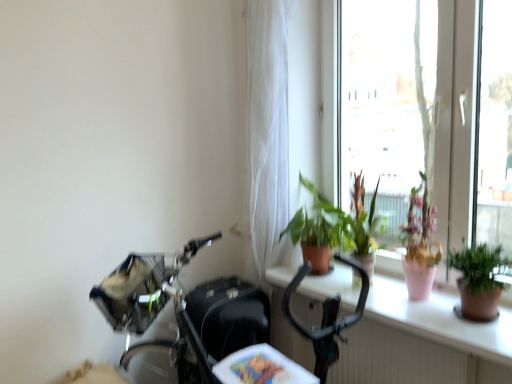
What is the approximate width of white sheer curtain at upper center?

9.20 inches.

What is the approximate width of green matte plant at upper right, the second houseplant in the back-to-front sequence?

9.58 inches.

Locate an element on the screen. This screenshot has width=512, height=384. white sheer curtain at upper center is located at coordinates (267, 132).

From a real-world perspective, between green matte plant at upper right, the 2th houseplant when ordered from left to right, and terracotta pot at center, who is vertically lower?

terracotta pot at center, from a real-world perspective.

Considering the sizes of objects green matte plant at upper right, placed as the first houseplant when sorted from right to left, and terracotta pot at center in the image provided, who is wider, green matte plant at upper right, placed as the first houseplant when sorted from right to left, or terracotta pot at center?

terracotta pot at center is wider.

Is green matte plant at upper right, placed as the first houseplant when sorted from right to left, aimed at terracotta pot at center?

No, green matte plant at upper right, placed as the first houseplant when sorted from right to left, is not turned towards terracotta pot at center.

How much distance is there between green matte plant at upper right, which appears as the 1th houseplant when viewed from the front, and terracotta pot at center?

green matte plant at upper right, which appears as the 1th houseplant when viewed from the front, is 8.09 inches from terracotta pot at center.

From the image's perspective, which one is positioned lower, white plastic radiator at lower center or green matte plant at upper right, the 1th houseplant in the left-to-right sequence?

white plastic radiator at lower center, from the image's perspective.

Choose the correct answer: Is white plastic radiator at lower center inside green matte plant at upper right, which ranks as the second houseplant in front-to-back order, or outside it?

white plastic radiator at lower center lies outside green matte plant at upper right, which ranks as the second houseplant in front-to-back order.

Is white plastic radiator at lower center facing away from green matte plant at upper right, the 1th houseplant in the left-to-right sequence?

white plastic radiator at lower center is not turned away from green matte plant at upper right, the 1th houseplant in the left-to-right sequence.

Would you consider black matte mountain bike at center to be distant from white plastic radiator at lower center?

No, black matte mountain bike at center is in close proximity to white plastic radiator at lower center.

Looking at this image, which is correct: black matte mountain bike at center is inside white plastic radiator at lower center, or outside of it?

black matte mountain bike at center is located beyond the bounds of white plastic radiator at lower center.

Based on the photo, from a real-world perspective, does black matte mountain bike at center stand above white plastic radiator at lower center?

Yes.

Based on the photo, can you confirm if black matte mountain bike at center is wider than white plastic radiator at lower center?

Yes.

Between white sheer curtain at upper center and green matte plant at upper right, which ranks as the second houseplant in front-to-back order, which one appears on the left side from the viewer's perspective?

white sheer curtain at upper center is more to the left.

From the picture: From a real-world perspective, is white sheer curtain at upper center physically located above or below green matte plant at upper right, which ranks as the second houseplant in front-to-back order?

In terms of real-world spatial position, white sheer curtain at upper center is above green matte plant at upper right, which ranks as the second houseplant in front-to-back order.

Who is bigger, white sheer curtain at upper center or green matte plant at upper right, the second houseplant from the right?

Bigger between the two is white sheer curtain at upper center.

In the image, is white sheer curtain at upper center positioned in front of or behind green matte plant at upper right, the second houseplant from the right?

white sheer curtain at upper center is positioned closer to the viewer than green matte plant at upper right, the second houseplant from the right.

Is black matte mountain bike at center oriented towards green matte plant at upper right, placed as the first houseplant when sorted from right to left?

No, black matte mountain bike at center is not facing towards green matte plant at upper right, placed as the first houseplant when sorted from right to left.

Is green matte plant at upper right, placed as the first houseplant when sorted from right to left, located within black matte mountain bike at center?

Definitely not — green matte plant at upper right, placed as the first houseplant when sorted from right to left, is not inside black matte mountain bike at center.

In terms of width, does black matte mountain bike at center look wider or thinner when compared to green matte plant at upper right, the 2th houseplant when ordered from left to right?

In the image, black matte mountain bike at center appears to be wider than green matte plant at upper right, the 2th houseplant when ordered from left to right.

How many degrees apart are the facing directions of green matte plant at upper right, which appears as the 1th houseplant when viewed from the front, and transparent glass window at upper right?

There is a 1.72-degree angle between the facing directions of green matte plant at upper right, which appears as the 1th houseplant when viewed from the front, and transparent glass window at upper right.

Identify the location of window lying on the left of green matte plant at upper right, the 2th houseplant when ordered from left to right. This screenshot has height=384, width=512. (455, 119).

Is green matte plant at upper right, the second houseplant in the back-to-front sequence, surrounding transparent glass window at upper right?

No, transparent glass window at upper right is not surrounded by green matte plant at upper right, the second houseplant in the back-to-front sequence.

Is point (477, 307) farther from camera compared to point (329, 76)?

No, (477, 307) is in front of (329, 76).

From the image's perspective, does transparent glass window at upper right appear lower than white sheer curtain at upper center?

Incorrect, from the image's perspective, transparent glass window at upper right is higher than white sheer curtain at upper center.

Considering the relative sizes of transparent glass window at upper right and white sheer curtain at upper center in the image provided, is transparent glass window at upper right wider than white sheer curtain at upper center?

In fact, transparent glass window at upper right might be narrower than white sheer curtain at upper center.

Is transparent glass window at upper right closer to camera compared to white sheer curtain at upper center?

That is True.

From a real-world perspective, is transparent glass window at upper right beneath white sheer curtain at upper center?

No.

Image resolution: width=512 pixels, height=384 pixels. What are the coordinates of `houseplant that is the 1st object located above the terracotta pot at center (from the image's perspective)` in the screenshot? It's located at (478, 280).

The image size is (512, 384). What are the coordinates of `radiator located on the right of green matte plant at upper right, which ranks as the second houseplant in front-to-back order` in the screenshot? It's located at (395, 358).

Which object lies nearer to the anchor point green matte plant at upper right, which appears as the 1th houseplant when viewed from the front, white plastic radiator at lower center or black matte mountain bike at center?

Among the two, white plastic radiator at lower center is located nearer to green matte plant at upper right, which appears as the 1th houseplant when viewed from the front.

Based on their spatial positions, is terracotta pot at center or white plastic radiator at lower center closer to transparent glass window at upper right?

terracotta pot at center is closer to transparent glass window at upper right.

Looking at the image, which one is located further to white sheer curtain at upper center, green matte plant at upper right, the second houseplant from the right, or black matte mountain bike at center?

The object further to white sheer curtain at upper center is black matte mountain bike at center.

When comparing their distances from green matte plant at upper right, the first houseplant when ordered from back to front, does black matte mountain bike at center or green matte plant at upper right, which appears as the 1th houseplant when viewed from the front, seem further?

green matte plant at upper right, which appears as the 1th houseplant when viewed from the front.

Considering their positions, is terracotta pot at center positioned closer to white plastic radiator at lower center than transparent glass window at upper right?

Among the two, terracotta pot at center is located nearer to white plastic radiator at lower center.

When comparing their distances from green matte plant at upper right, placed as the first houseplant when sorted from right to left, does white sheer curtain at upper center or black matte mountain bike at center seem closer?

The object closer to green matte plant at upper right, placed as the first houseplant when sorted from right to left, is black matte mountain bike at center.

Based on their spatial positions, is green matte plant at upper right, which ranks as the second houseplant in front-to-back order, or transparent glass window at upper right further from black matte mountain bike at center?

transparent glass window at upper right.

Looking at the image, which one is located closer to green matte plant at upper right, which appears as the 1th houseplant when viewed from the front, white sheer curtain at upper center or terracotta pot at center?

Among the two, terracotta pot at center is located nearer to green matte plant at upper right, which appears as the 1th houseplant when viewed from the front.

Identify the location of window sill between green matte plant at upper right, placed as the first houseplant when sorted from right to left, and white plastic radiator at lower center in the up-down direction. The width and height of the screenshot is (512, 384). (439, 320).

Find the location of a particular element. curtain between transparent glass window at upper right and black matte mountain bike at center vertically is located at coordinates (267, 132).

The width and height of the screenshot is (512, 384). I want to click on curtain between transparent glass window at upper right and terracotta pot at center in the vertical direction, so [x=267, y=132].

This screenshot has width=512, height=384. In order to click on window sill between black matte mountain bike at center and white plastic radiator at lower center in this screenshot , I will do `click(439, 320)`.